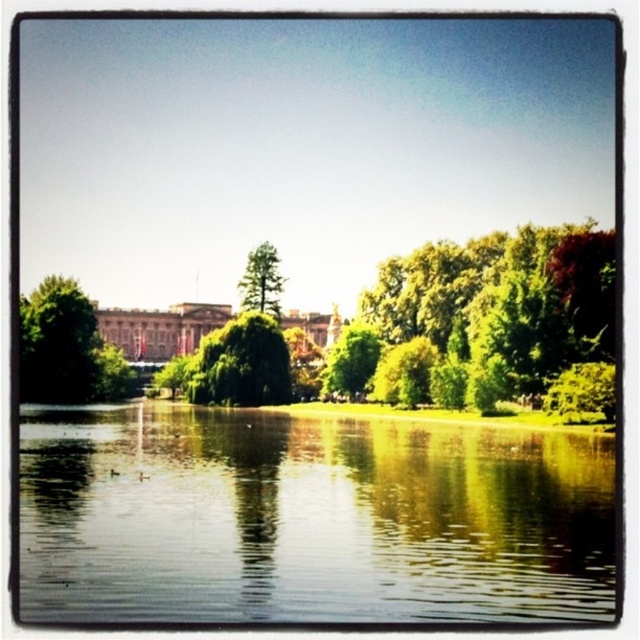
You are standing at the edge of the water and see the green leafy tree at center and the green matte tree at center. Which tree is located to the right of the other?

The green leafy tree at center is positioned on the right side of the green matte tree at center.